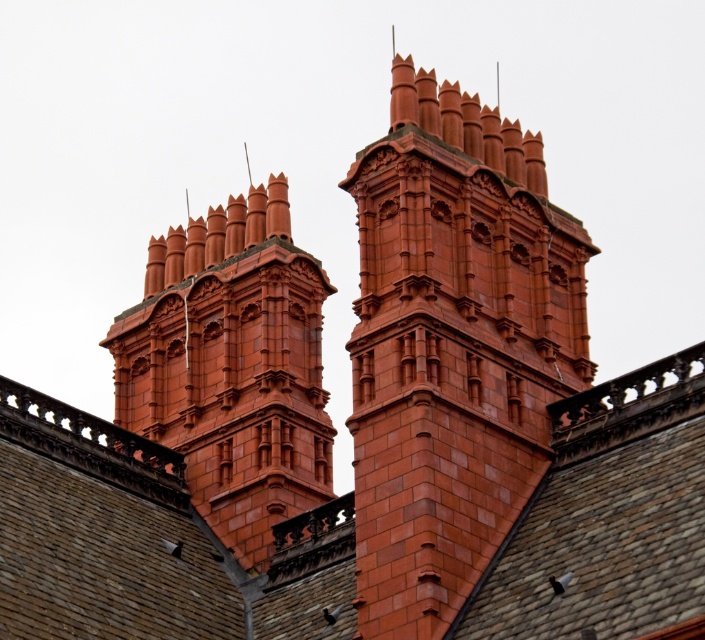
Question: Which point appears farthest from the camera in this image?

Choices:
 (A) (407, 460)
 (B) (686, 556)

Answer: (A)

Question: In this image, where is smooth slate roof at center located relative to matte brick chimney at upper center?

Choices:
 (A) above
 (B) below

Answer: (B)

Question: Is smooth slate roof at center bigger than matte brick tower at center?

Choices:
 (A) no
 (B) yes

Answer: (B)

Question: Can you confirm if matte brick tower at center is bigger than matte brick chimney at upper center?

Choices:
 (A) yes
 (B) no

Answer: (B)

Question: Among these objects, which one is farthest from the camera?

Choices:
 (A) matte brick tower at center
 (B) smooth slate roof at center
 (C) matte brick chimney at upper center

Answer: (C)

Question: Which point is closer to the camera?

Choices:
 (A) (369, 289)
 (B) (331, 458)
 (C) (75, 456)

Answer: (A)